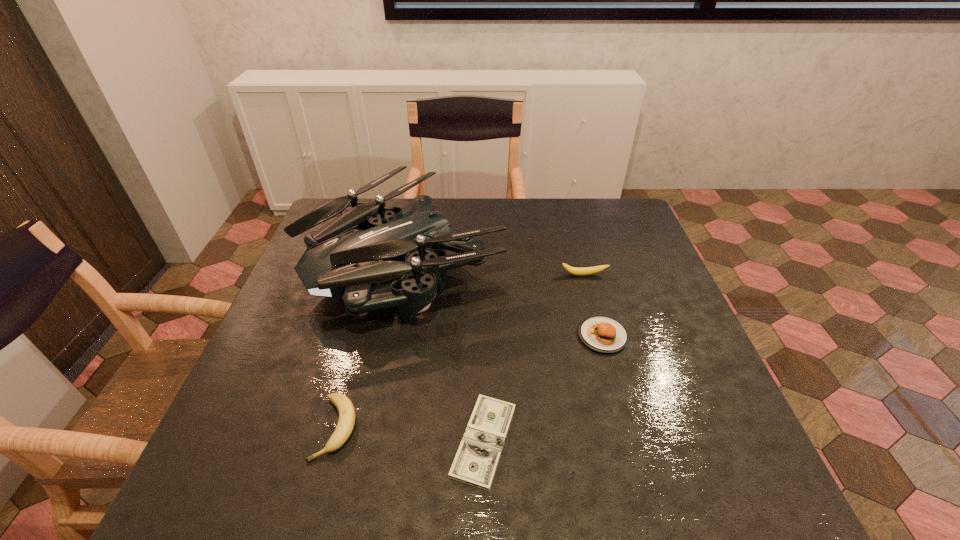
This screenshot has width=960, height=540. In order to click on vacant space located on the right of the dollar in this screenshot , I will do `click(559, 441)`.

You are a GUI agent. You are given a task and a screenshot of the screen. Output one action in this format:
    pyautogui.click(x=<x>, y=<y>)
    Task: Click on the object located in the far edge section of the desktop
    Image resolution: width=960 pixels, height=540 pixels.
    Given the screenshot: What is the action you would take?
    pyautogui.click(x=366, y=244)

Where is `banana located at the near edge`? The width and height of the screenshot is (960, 540). banana located at the near edge is located at coordinates (346, 410).

This screenshot has width=960, height=540. I want to click on dollar that is positioned at the near edge, so click(475, 463).

Image resolution: width=960 pixels, height=540 pixels. Find the location of `object located in the left edge section of the desktop`. object located in the left edge section of the desktop is located at coordinates 366,244.

Locate an element on the screen. banana that is positioned at the right edge is located at coordinates (584, 271).

In order to click on food present at the right edge in this screenshot , I will do `click(601, 334)`.

Where is `object at the far left corner`? The image size is (960, 540). object at the far left corner is located at coordinates (366, 244).

In the image, there is a desktop. What are the coordinates of `vacant area at the far edge` in the screenshot? It's located at (549, 204).

Find the location of a particular element. The height and width of the screenshot is (540, 960). vacant region at the near edge of the desktop is located at coordinates (668, 494).